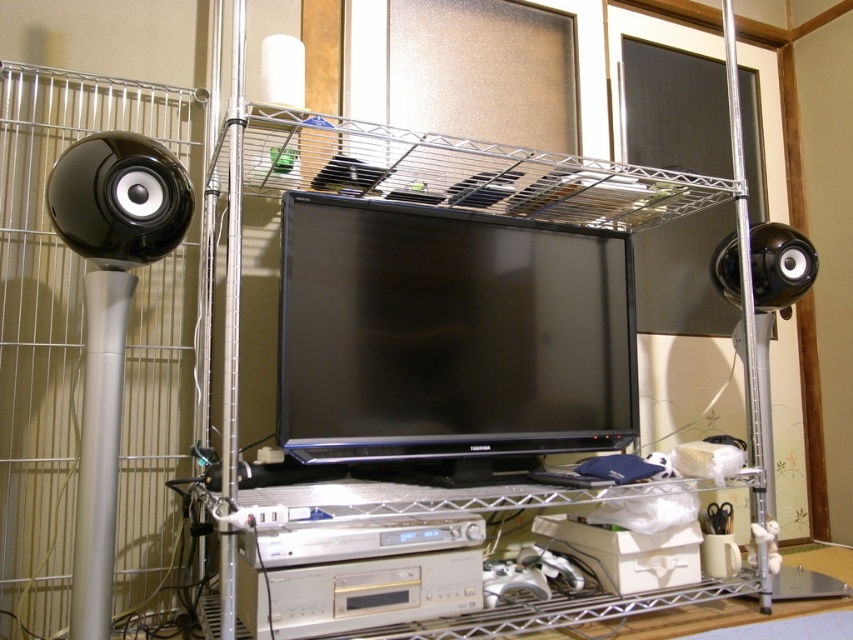
Can you confirm if black glossy flat screen tv at center is positioned below black glossy speaker at right?

Correct, black glossy flat screen tv at center is located below black glossy speaker at right.

Between black glossy flat screen tv at center and black glossy speaker at right, which one is positioned lower?

black glossy flat screen tv at center

Where is `black glossy flat screen tv at center`? Image resolution: width=853 pixels, height=640 pixels. black glossy flat screen tv at center is located at coordinates (450, 333).

Can you confirm if satin black monitor at center is positioned below black glossy speaker at right?

Indeed, satin black monitor at center is positioned under black glossy speaker at right.

Can you confirm if satin black monitor at center is positioned above black glossy speaker at right?

Actually, satin black monitor at center is below black glossy speaker at right.

This screenshot has width=853, height=640. Find the location of `satin black monitor at center`. satin black monitor at center is located at coordinates (451, 292).

Find the location of a particular element. This screenshot has height=640, width=853. satin black monitor at center is located at coordinates (451, 292).

Is black glossy flat screen tv at center smaller than glossy black speaker at left?

Incorrect, black glossy flat screen tv at center is not smaller in size than glossy black speaker at left.

Is point (555, 445) in front of point (169, 225)?

That is False.

I want to click on black glossy flat screen tv at center, so click(x=450, y=333).